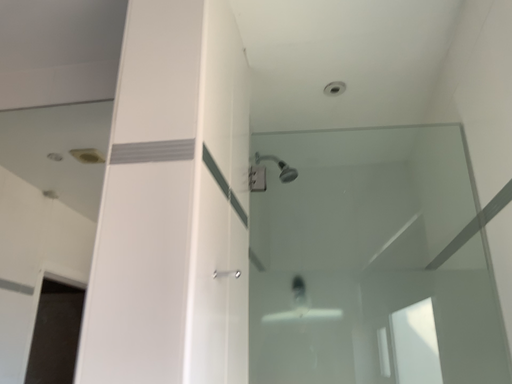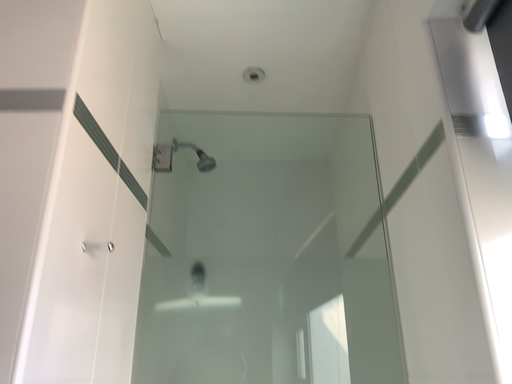
Question: Which way did the camera rotate in the video?

Choices:
 (A) rotated left
 (B) rotated right

Answer: (B)